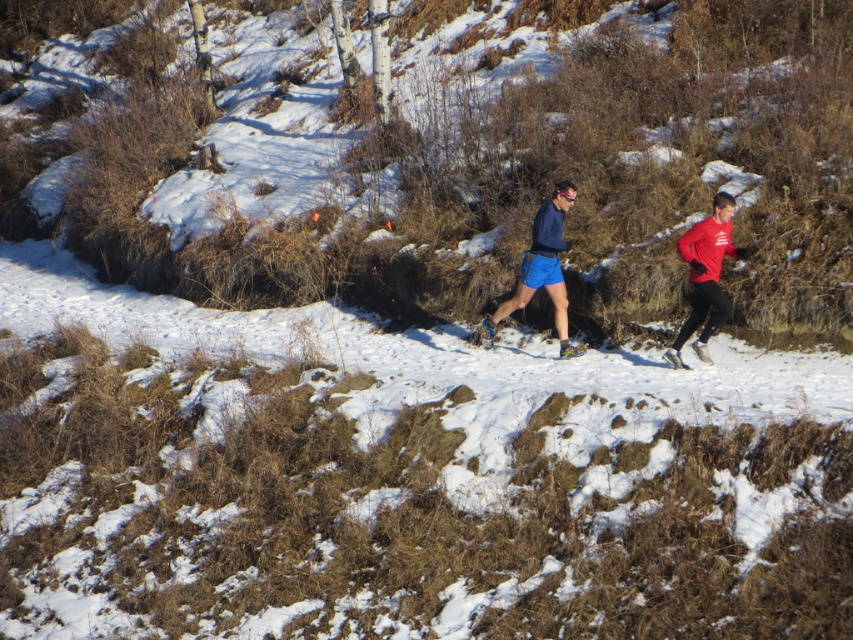
You are a photographer positioned on the snow trail and want to capture both the matte blue shorts at center and the red matte running suit at right in a single shot. Which runner should you focus on first to ensure both are in frame?

You should focus on the matte blue shorts at center first because it is closer to you than the red matte running suit at right, ensuring both are in frame.

You are a photographer trying to capture a photo of the runners. You want to position yourself so that the matte blue shorts at center and the red matte running suit at right are both visible in the frame. Based on their positions, which runner should be closer to the left edge of your camera view?

The matte blue shorts at center are to the right of the red matte running suit at right, so the red matte running suit at right should be closer to the left edge of the camera view.

You are a photographer positioned at the center of the snow trail. You want to capture both the red matte running suit at right and the blue matte shorts at center in a single frame. Given that your camera has a 1.5 meter focal length, will you be able to include both subjects in the photo?

The distance between the red matte running suit at right and the blue matte shorts at center is 1.40 meters, which is less than the camera focal length of 1.5 meters. Therefore, both subjects can be captured in a single frame.